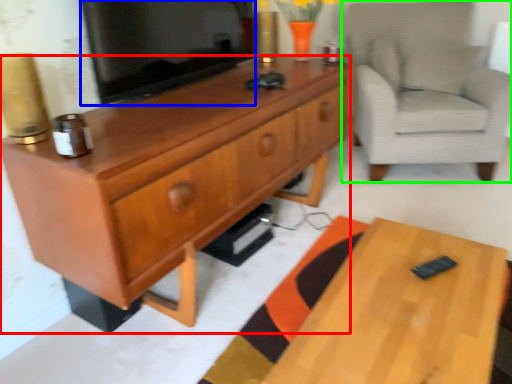
Question: Which is nearer to the cabinetry (highlighted by a red box)? television (highlighted by a blue box) or chair (highlighted by a green box).

Choices:
 (A) television
 (B) chair

Answer: (A)